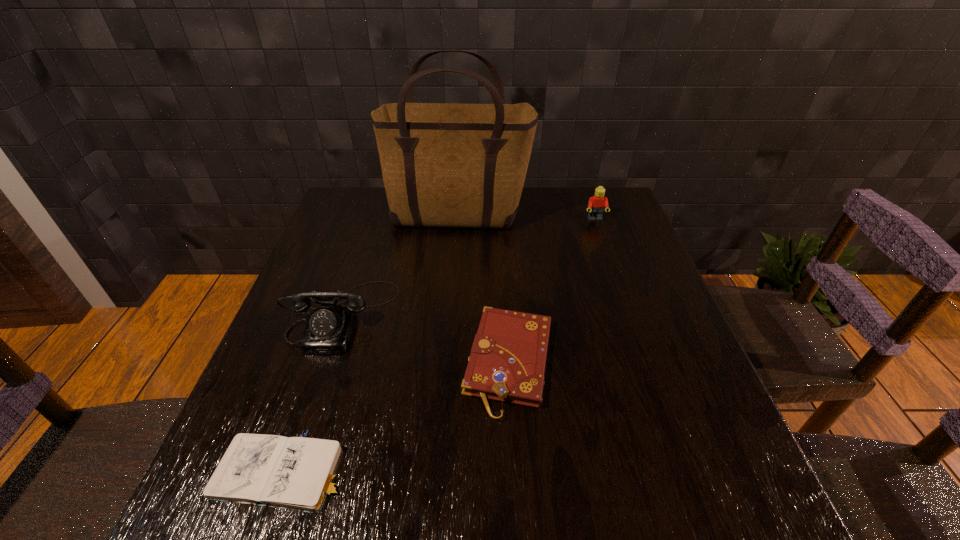
Locate an element on the screen. vacant position at the far edge of the desktop is located at coordinates (560, 228).

The height and width of the screenshot is (540, 960). In the image, there is a desktop. What are the coordinates of `free space at the left edge` in the screenshot? It's located at (324, 264).

This screenshot has width=960, height=540. What are the coordinates of `vacant space at the right edge` in the screenshot? It's located at (688, 405).

Identify the location of free space at the far left corner of the desktop. (377, 195).

At what (x,y) coordinates should I click in order to perform the action: click on vacant point at the near right corner. Please return your answer as a coordinate pair (x, y). This screenshot has width=960, height=540. Looking at the image, I should click on (756, 523).

Where is `free space that is in between the tote bag and the left notebook`? free space that is in between the tote bag and the left notebook is located at coordinates (370, 346).

Find the location of a particular element. empty space that is in between the telephone and the shorter notebook is located at coordinates (311, 394).

You are a GUI agent. You are given a task and a screenshot of the screen. Output one action in this format:
    pyautogui.click(x=<x>, y=<y>)
    Task: Click on the empty space between the tote bag and the telephone
    The height and width of the screenshot is (540, 960).
    Given the screenshot: What is the action you would take?
    pyautogui.click(x=399, y=267)

You are a GUI agent. You are given a task and a screenshot of the screen. Output one action in this format:
    pyautogui.click(x=<x>, y=<y>)
    Task: Click on the unoccupied area between the Lego and the fourth tallest object
    The width and height of the screenshot is (960, 540).
    Given the screenshot: What is the action you would take?
    pyautogui.click(x=552, y=291)

Find the location of a particular element. This screenshot has height=540, width=960. vacant region between the telephone and the tallest object is located at coordinates (399, 267).